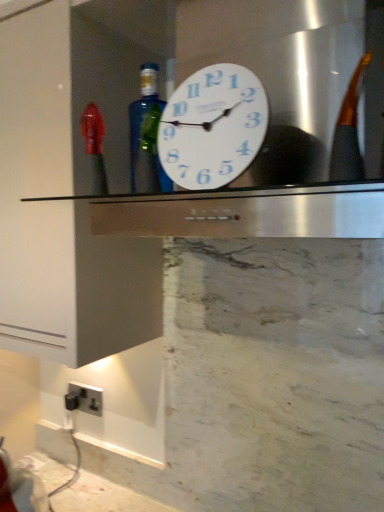
Question: Is white plastic clock at center to the left of satin silver plug socket at lower left from the viewer's perspective?

Choices:
 (A) no
 (B) yes

Answer: (A)

Question: Are white plastic clock at center and satin silver plug socket at lower left far apart?

Choices:
 (A) yes
 (B) no

Answer: (B)

Question: Is white plastic clock at center looking in the opposite direction of satin silver plug socket at lower left?

Choices:
 (A) no
 (B) yes

Answer: (A)

Question: Is white plastic clock at center next to satin silver plug socket at lower left?

Choices:
 (A) yes
 (B) no

Answer: (B)

Question: Can you confirm if white plastic clock at center is smaller than satin silver plug socket at lower left?

Choices:
 (A) yes
 (B) no

Answer: (B)

Question: Is white plastic clock at center aimed at satin silver plug socket at lower left?

Choices:
 (A) yes
 (B) no

Answer: (B)

Question: From the image's perspective, does blue glass bottle at center appear higher than white plastic clock at center?

Choices:
 (A) yes
 (B) no

Answer: (B)

Question: Is blue glass bottle at center in front of white plastic clock at center?

Choices:
 (A) no
 (B) yes

Answer: (A)

Question: Can you confirm if blue glass bottle at center is positioned to the right of white plastic clock at center?

Choices:
 (A) yes
 (B) no

Answer: (B)

Question: From the image's perspective, is blue glass bottle at center under white plastic clock at center?

Choices:
 (A) no
 (B) yes

Answer: (B)

Question: Is blue glass bottle at center bigger than white plastic clock at center?

Choices:
 (A) yes
 (B) no

Answer: (B)

Question: Considering the relative sizes of blue glass bottle at center and white plastic clock at center in the image provided, is blue glass bottle at center taller than white plastic clock at center?

Choices:
 (A) yes
 (B) no

Answer: (B)

Question: Is satin silver plug socket at lower left at the right side of white plastic clock at center?

Choices:
 (A) no
 (B) yes

Answer: (A)